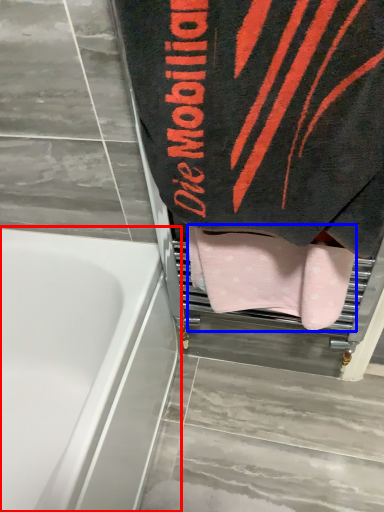
Question: Which of the following is the farthest to the observer, bathtub (highlighted by a red box) or towel (highlighted by a blue box)?

Choices:
 (A) bathtub
 (B) towel

Answer: (B)